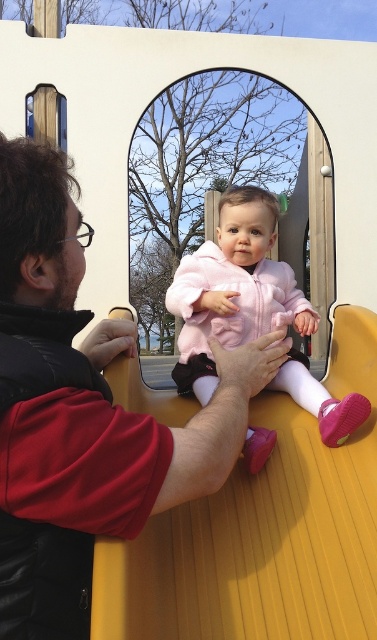
Does matte black jacket at left have a lesser width compared to matte yellow slide at center?

Yes, matte black jacket at left is thinner than matte yellow slide at center.

Between point (110, 323) and point (145, 406), which one is positioned in front?

Positioned in front is point (110, 323).

Where is `matte black jacket at left`? matte black jacket at left is located at coordinates (84, 410).

In the scene shown: Who is lower down, matte black jacket at left or pink fleece jacket at center?

matte black jacket at left is lower down.

Between matte black jacket at left and pink fleece jacket at center, which one has less height?

pink fleece jacket at center

Between point (128, 515) and point (246, 260), which one is positioned in front?

Positioned in front is point (128, 515).

This screenshot has height=640, width=377. In order to click on matte black jacket at left in this screenshot , I will do `click(84, 410)`.

Who is positioned more to the left, matte yellow slide at center or pink fleece jacket at center?

Positioned to the left is matte yellow slide at center.

This screenshot has height=640, width=377. Identify the location of matte yellow slide at center. (263, 532).